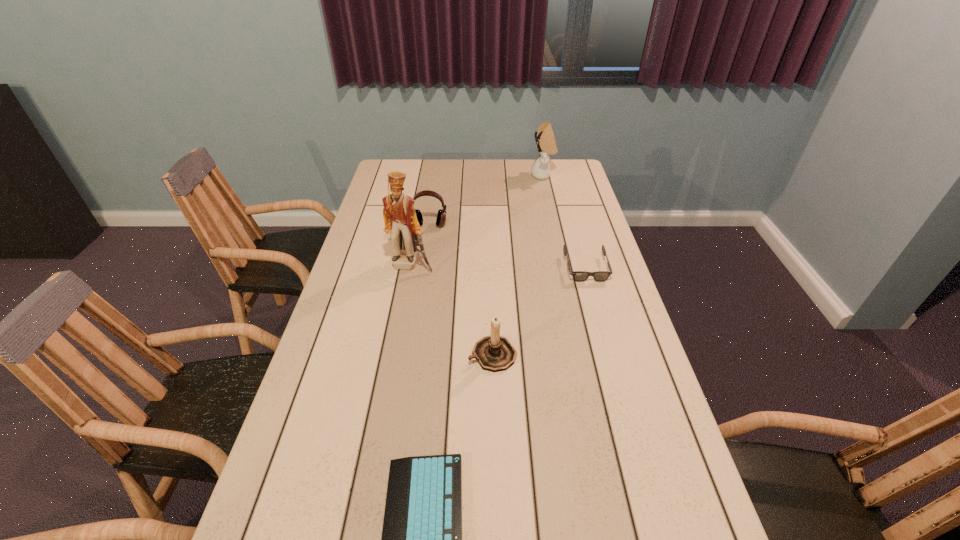
You are a GUI agent. You are given a task and a screenshot of the screen. Output one action in this format:
    pyautogui.click(x=<x>, y=<y>)
    Task: Click on the free space that satisfies the following two spatial constraints: 1. on the ear pads of the headset; 2. on the right side of the candle holder
    
    Given the screenshot: What is the action you would take?
    pyautogui.click(x=410, y=355)

Where is `free space in the image that satisfies the following two spatial constraints: 1. at the front face of the farthest object; 2. on the ear pads of the second farthest object`? The width and height of the screenshot is (960, 540). free space in the image that satisfies the following two spatial constraints: 1. at the front face of the farthest object; 2. on the ear pads of the second farthest object is located at coordinates (554, 225).

Find the location of a particular element. free point that satisfies the following two spatial constraints: 1. at the front face of the fifth shortest object; 2. on the ear pads of the headset is located at coordinates (554, 225).